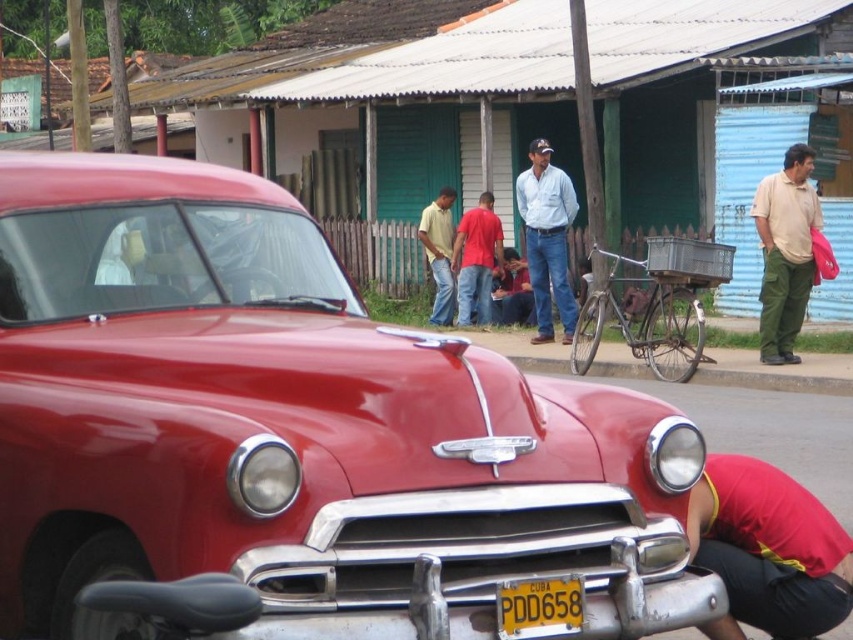
Question: Considering the real-world distances, which object is farthest from the light blue denim shirt at center?

Choices:
 (A) glossy red car at center
 (B) gray concrete curb at lower center

Answer: (A)

Question: Is red fabric squat at lower right further to the viewer compared to matte yellow shirt at center?

Choices:
 (A) no
 (B) yes

Answer: (A)

Question: Which point is farther to the camera?

Choices:
 (A) gray concrete curb at lower center
 (B) yellow metallic license plate at lower center

Answer: (A)

Question: Does glossy red car at center appear on the right side of gray concrete curb at lower center?

Choices:
 (A) no
 (B) yes

Answer: (A)

Question: Which is nearer to the gray concrete curb at lower center?

Choices:
 (A) matte yellow shirt at center
 (B) light blue denim shirt at center
 (C) matte khaki pants at right
 (D) glossy red car at center

Answer: (C)

Question: Can you confirm if gray concrete curb at lower center is smaller than matte yellow shirt at center?

Choices:
 (A) yes
 (B) no

Answer: (A)